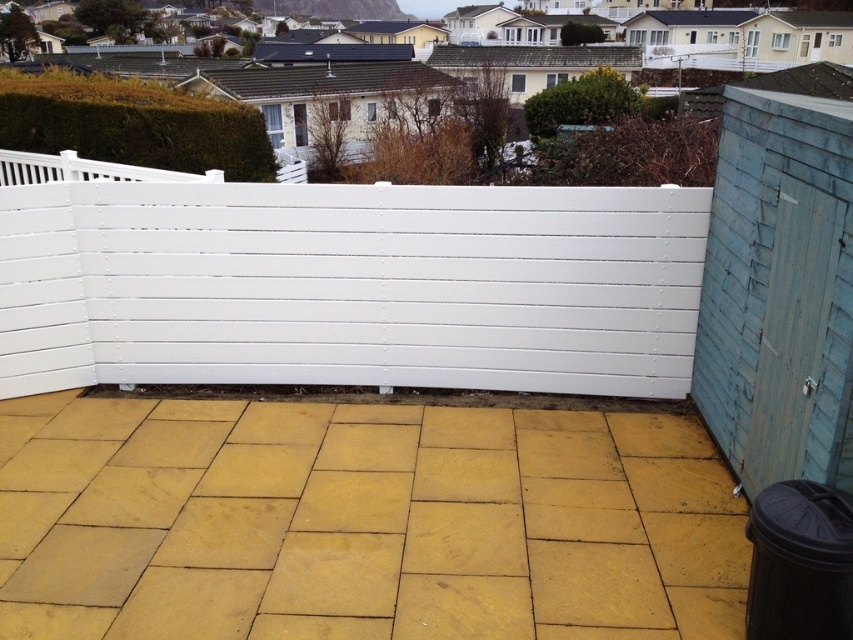
Can you confirm if yellow stone tiles at center is bigger than yellow stone tile at lower left?

Yes, yellow stone tiles at center is bigger than yellow stone tile at lower left.

Does yellow stone tiles at center have a greater height compared to yellow stone tile at lower left?

Correct, yellow stone tiles at center is much taller as yellow stone tile at lower left.

Measure the distance between point (416, 563) and camera.

A distance of 10.15 feet exists between point (416, 563) and camera.

I want to click on yellow stone tiles at center, so click(361, 522).

Is yellow stone tiles at center wider than blue wooden shed at right?

Indeed, yellow stone tiles at center has a greater width compared to blue wooden shed at right.

Can you confirm if yellow stone tiles at center is shorter than blue wooden shed at right?

Correct, yellow stone tiles at center is not as tall as blue wooden shed at right.

The width and height of the screenshot is (853, 640). What do you see at coordinates (361, 522) in the screenshot? I see `yellow stone tiles at center` at bounding box center [361, 522].

Where is `yellow stone tiles at center`? This screenshot has height=640, width=853. yellow stone tiles at center is located at coordinates (361, 522).

Between point (799, 246) and point (28, 596), which one is positioned in front?

Point (28, 596) is in front.

Is point (788, 218) positioned in front of point (86, 531)?

Yes, it is.

The width and height of the screenshot is (853, 640). I want to click on blue wooden shed at right, so click(x=779, y=291).

The height and width of the screenshot is (640, 853). I want to click on blue wooden shed at right, so click(779, 291).